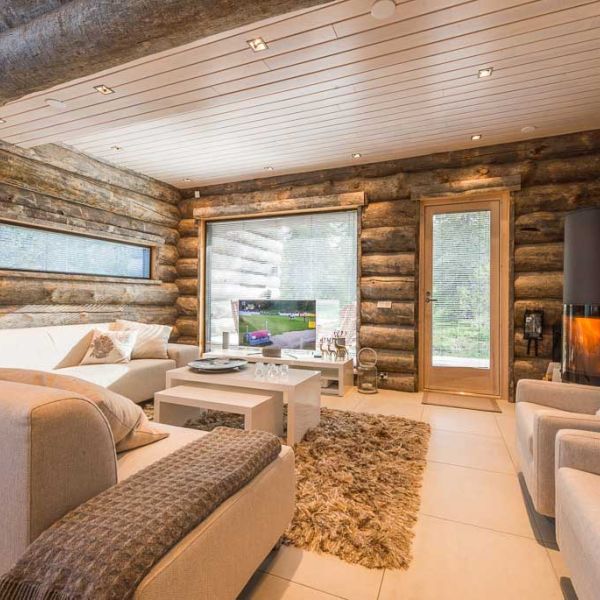
This screenshot has width=600, height=600. I want to click on 3 sofa pillows, so click(x=124, y=415), click(x=113, y=338), click(x=137, y=335).